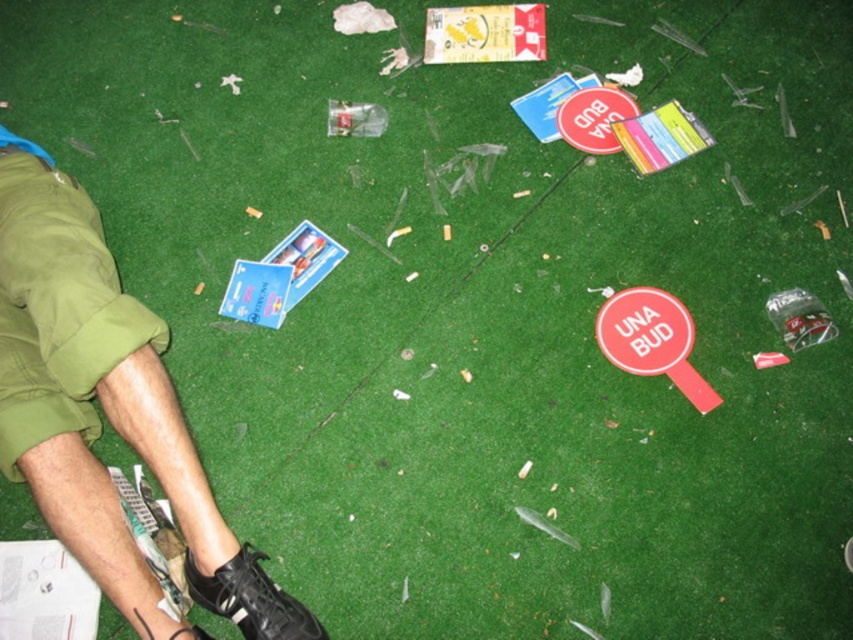
Is green cotton shorts at lower left bigger than black leather shoe at lower left?

Yes, green cotton shorts at lower left is bigger than black leather shoe at lower left.

Is green cotton shorts at lower left to the right of black leather shoe at lower left from the viewer's perspective?

No, green cotton shorts at lower left is not to the right of black leather shoe at lower left.

Which is behind, point (190, 528) or point (190, 595)?

Point (190, 595)

Where is `green cotton shorts at lower left`? Image resolution: width=853 pixels, height=640 pixels. green cotton shorts at lower left is located at coordinates (105, 410).

Based on the photo, is green cotton shorts at lower left further to camera compared to black leather shoe at lower center?

No, green cotton shorts at lower left is in front of black leather shoe at lower center.

Is green cotton shorts at lower left smaller than black leather shoe at lower center?

Incorrect, green cotton shorts at lower left is not smaller in size than black leather shoe at lower center.

Which is in front, point (51, 432) or point (137, 612)?

Point (137, 612)

Identify the location of green cotton shorts at lower left. The image size is (853, 640). (105, 410).

Measure the distance from black leather shoe at lower left to red plastic sign at lower right.

They are 30.79 inches apart.

Can you confirm if black leather shoe at lower left is shorter than red plastic sign at lower right?

Indeed, black leather shoe at lower left has a lesser height compared to red plastic sign at lower right.

Does point (229, 598) lie behind point (631, 291)?

No, it is not.

Find the location of `black leather shoe at lower left`. black leather shoe at lower left is located at coordinates (250, 598).